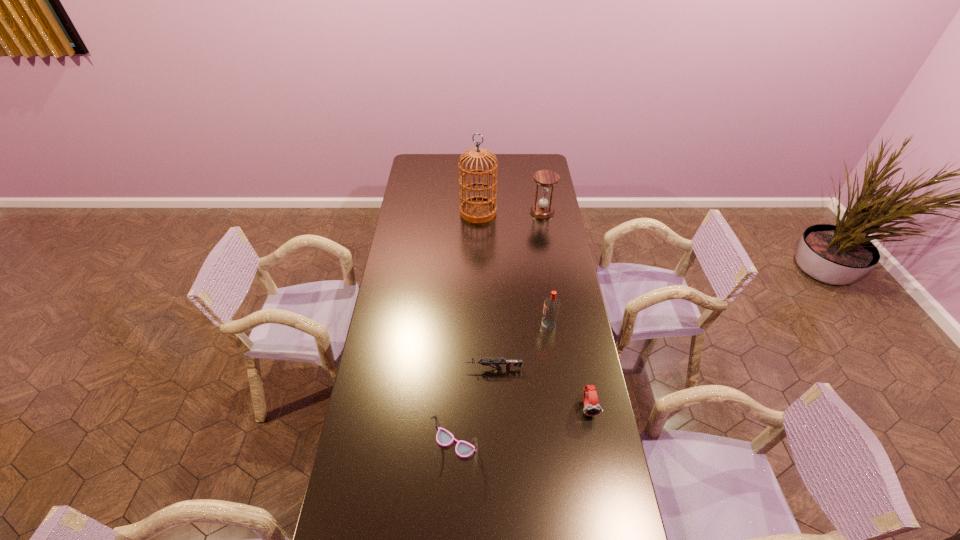
You are a GUI agent. You are given a task and a screenshot of the screen. Output one action in this format:
    pyautogui.click(x=<x>, y=<y>)
    Task: Click on the vacant region between the nearest object and the tallest object
    The width and height of the screenshot is (960, 540).
    Given the screenshot: What is the action you would take?
    tap(467, 328)

The height and width of the screenshot is (540, 960). I want to click on free point between the spectacles and the second shortest object, so click(521, 425).

This screenshot has width=960, height=540. Find the location of `free space between the second shortest object and the spectacles`. free space between the second shortest object and the spectacles is located at coordinates (521, 425).

You are a GUI agent. You are given a task and a screenshot of the screen. Output one action in this format:
    pyautogui.click(x=<x>, y=<y>)
    Task: Click on the free space between the tallest object and the shortest object
    The height and width of the screenshot is (540, 960).
    Given the screenshot: What is the action you would take?
    pyautogui.click(x=486, y=291)

At what (x,y) coordinates should I click in order to perform the action: click on free point between the hourglass and the second shortest object. Please return your answer as a coordinate pair (x, y). This screenshot has width=960, height=540. Looking at the image, I should click on (565, 309).

You are a GUI agent. You are given a task and a screenshot of the screen. Output one action in this format:
    pyautogui.click(x=<x>, y=<y>)
    Task: Click on the free space between the fourth nearest object and the hourglass
    The height and width of the screenshot is (540, 960).
    Given the screenshot: What is the action you would take?
    pyautogui.click(x=545, y=269)

At what (x,y) coordinates should I click in order to perform the action: click on object identified as the fourth closest to the gun. Please return your answer as a coordinate pair (x, y). Looking at the image, I should click on (476, 209).

Where is `object that is the fourth closest to the nearest object`? This screenshot has width=960, height=540. object that is the fourth closest to the nearest object is located at coordinates (476, 209).

Where is `free space in the image that satisfies the following two spatial constraints: 1. on the back side of the spectacles; 2. on the right side of the hourglass`? This screenshot has width=960, height=540. free space in the image that satisfies the following two spatial constraints: 1. on the back side of the spectacles; 2. on the right side of the hourglass is located at coordinates (465, 212).

The height and width of the screenshot is (540, 960). I want to click on vacant space that satisfies the following two spatial constraints: 1. on the front side of the hourglass; 2. on the front label of the fourth nearest object, so click(561, 326).